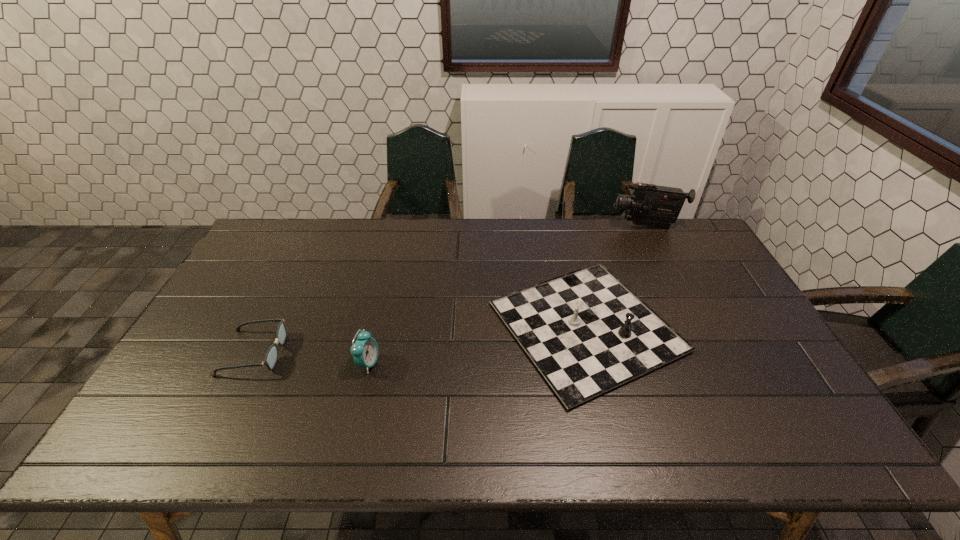
What are the coordinates of `free region at the near left corner of the desktop` in the screenshot? It's located at (159, 422).

This screenshot has width=960, height=540. Identify the location of vacant area at the far right corner of the desktop. (696, 229).

Locate an element on the screen. empty space that is in between the farthest object and the second shortest object is located at coordinates (616, 276).

This screenshot has height=540, width=960. I want to click on vacant area that lies between the third tallest object and the leftmost object, so click(x=420, y=340).

Locate an element on the screen. The height and width of the screenshot is (540, 960). free space that is in between the camcorder and the gameboard is located at coordinates (616, 276).

Locate an element on the screen. vacant area between the gameboard and the farthest object is located at coordinates (616, 276).

Find the location of a particular element. The width and height of the screenshot is (960, 540). free space between the alarm clock and the second shortest object is located at coordinates (477, 345).

Where is `unoccupied area between the alarm clock and the gameboard`? unoccupied area between the alarm clock and the gameboard is located at coordinates (477, 345).

I want to click on free space between the shortest object and the second object from left to right, so click(x=311, y=358).

Locate an element on the screen. This screenshot has width=960, height=540. free spot between the spectacles and the alarm clock is located at coordinates (311, 358).